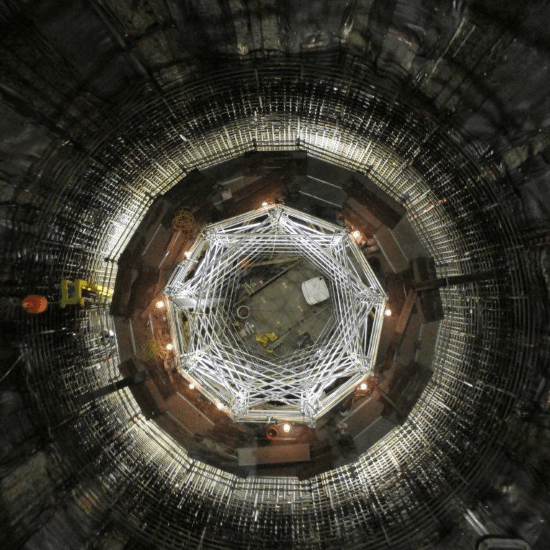
Find the location of a particular element. cable is located at coordinates (184, 217).